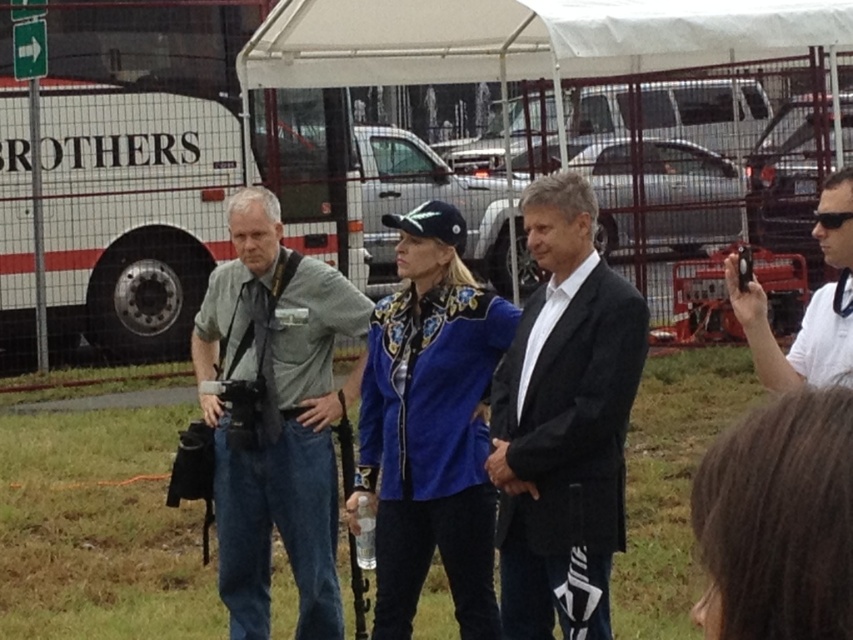
Which is below, black textured suit at center or black matte camera at right?

black textured suit at center

Image resolution: width=853 pixels, height=640 pixels. Describe the element at coordinates (563, 422) in the screenshot. I see `black textured suit at center` at that location.

The height and width of the screenshot is (640, 853). What do you see at coordinates (563, 422) in the screenshot?
I see `black textured suit at center` at bounding box center [563, 422].

Find the location of a particular element. This screenshot has height=640, width=853. black textured suit at center is located at coordinates (563, 422).

Locate an element on the screen. This screenshot has width=853, height=640. white fabric canopy at upper center is located at coordinates (524, 38).

Identify the location of white fabric canopy at upper center. (524, 38).

Locate an element on the screen. white fabric canopy at upper center is located at coordinates (524, 38).

Between black textured suit at center and white fabric canopy at upper center, which one is positioned higher?

Positioned higher is white fabric canopy at upper center.

Is black textured suit at center below white fabric canopy at upper center?

Yes.

Is point (529, 237) farther from camera compared to point (761, 54)?

No, it is not.

Find the location of `black textured suit at center`. black textured suit at center is located at coordinates (563, 422).